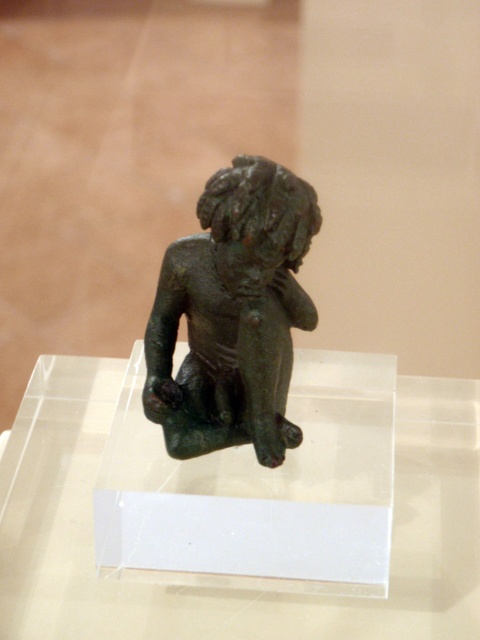
You are a museum visitor trying to take a photo of the bronze statue at center. The transparent acrylic glass table at center is in the way. Can you move the table to get a clear shot of the statue?

The bronze statue at center is behind the transparent acrylic glass table at center, so you cannot move the table because it is supporting the statue and is part of the display setup.

You are an art conservator examining the bronze statue at center displayed on the transparent acrylic glass table at center. Based on their heights, which object would require a taller storage container for proper preservation?

The bronze statue at center requires a taller storage container because it has a greater height than the transparent acrylic glass table at center.

You are standing in front of the bronze figurine displayed on the transparent acrylic stand. There is a point marked at coordinates point (x=456, y=564). Can you reach this point with your hand without moving your feet?

The point (x=456, y=564) is 1.32 meters away from you, so you can reach it with your hand without moving your feet since the average human arm length is about 0.7 meters and the distance is within reach.